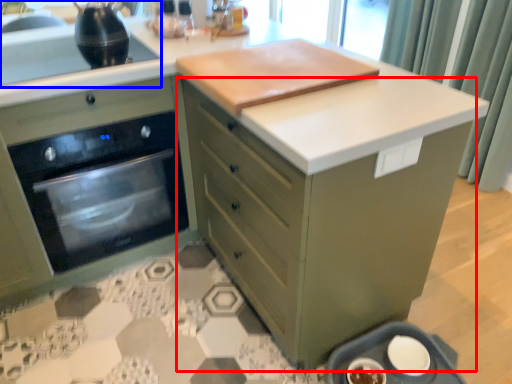
Question: Which point is further to the camera, cabinetry (highlighted by a red box) or sink (highlighted by a blue box)?

Choices:
 (A) cabinetry
 (B) sink

Answer: (B)